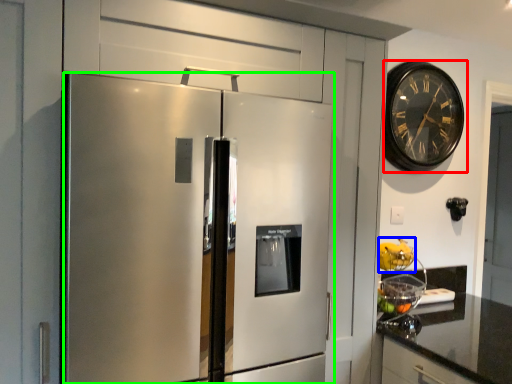
Question: Based on their relative distances, which object is farther from wall clock (highlighted by a red box)? Choose from fruit (highlighted by a blue box) and refrigerator (highlighted by a green box).

Choices:
 (A) fruit
 (B) refrigerator

Answer: (B)